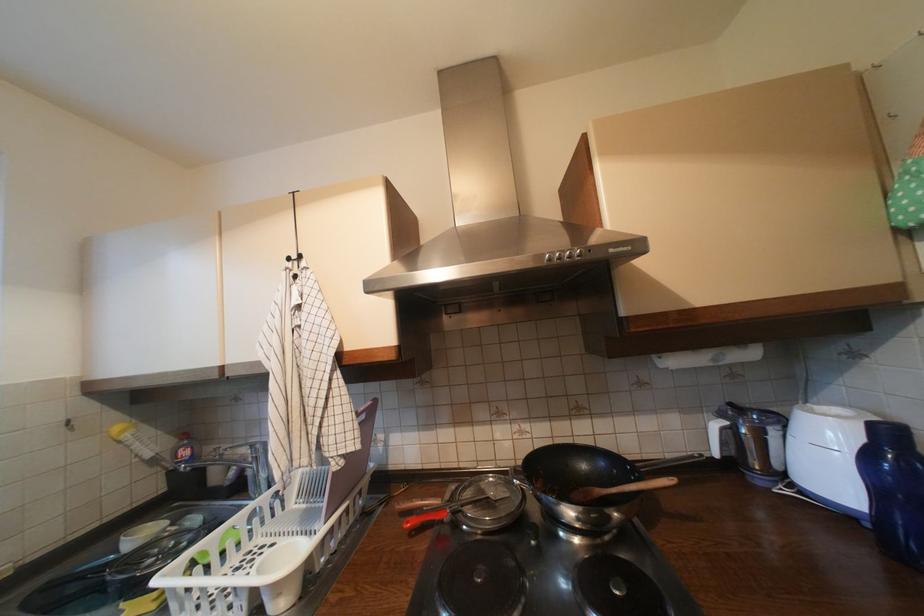
Identify the location of splatter guard handle. (417, 504).